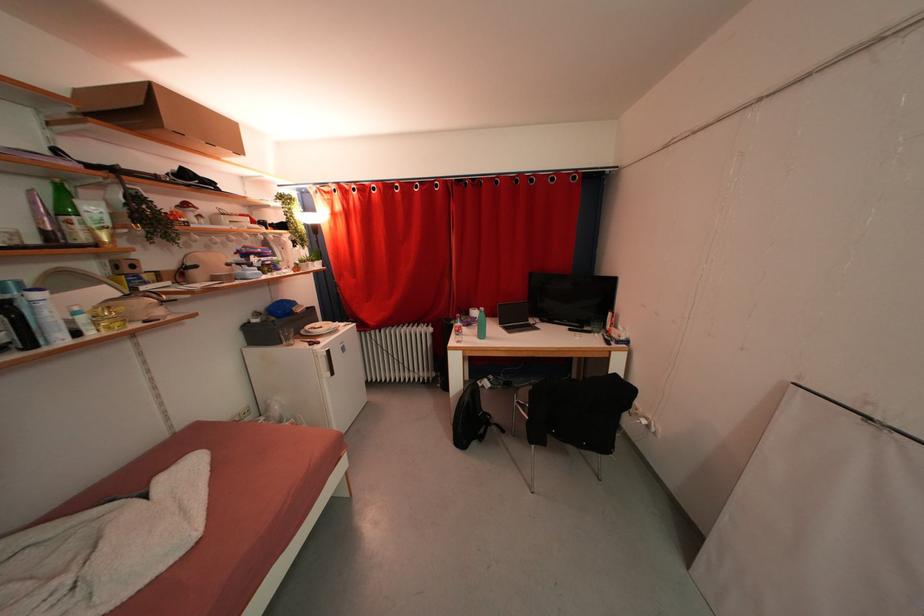
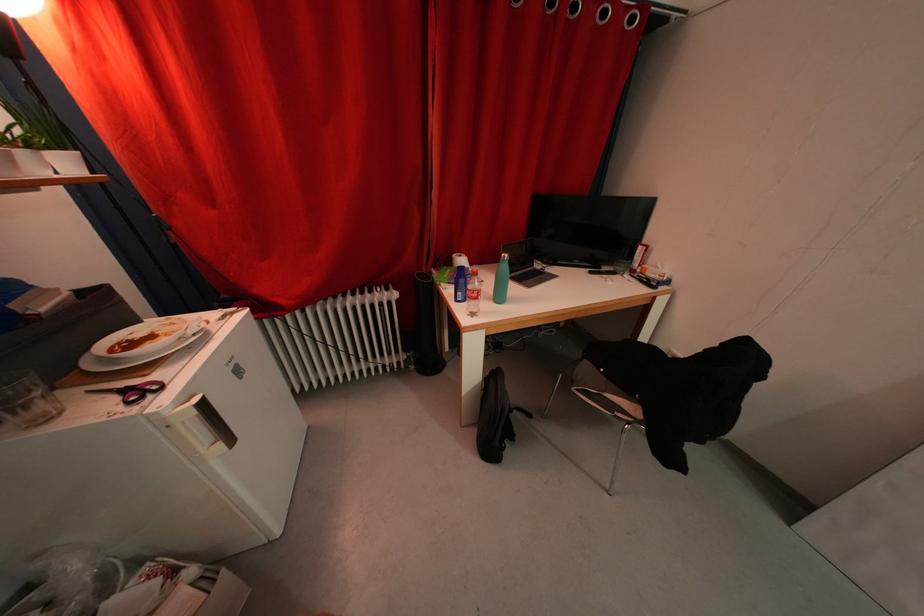
Where in the second image is the point corresponding to the point at 334,355 from the first image?

(209, 408)